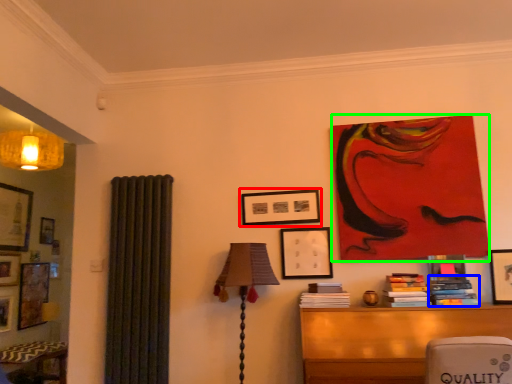
Question: Which object is positioned closest to picture frame (highlighted by a red box)? Select from book (highlighted by a blue box) and art (highlighted by a green box).

Choices:
 (A) book
 (B) art

Answer: (B)